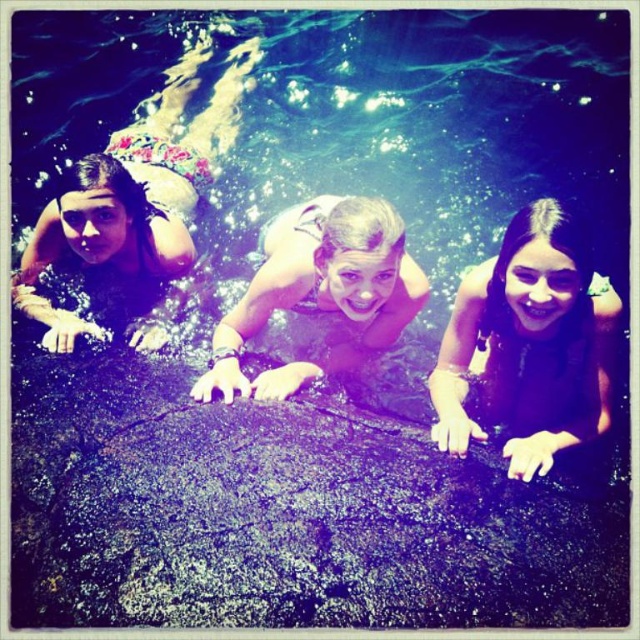
Is floral swimsuit at left further to camera compared to smooth skin girl at center?

Yes, it is.

Does floral swimsuit at left have a lesser height compared to smooth skin girl at center?

No.

What do you see at coordinates (134, 205) in the screenshot? I see `floral swimsuit at left` at bounding box center [134, 205].

This screenshot has width=640, height=640. Find the location of `floral swimsuit at left`. floral swimsuit at left is located at coordinates (134, 205).

Can you confirm if black matte hair at center is shorter than floral swimsuit at left?

Yes.

Can you confirm if black matte hair at center is positioned to the left of floral swimsuit at left?

In fact, black matte hair at center is to the right of floral swimsuit at left.

Which is behind, point (458, 364) or point (54, 346)?

The point (54, 346) is behind.

Identify the location of black matte hair at center. (531, 342).

Between black matte hair at center and smooth skin girl at center, which one appears on the right side from the viewer's perspective?

Positioned to the right is black matte hair at center.

Which is in front, point (532, 262) or point (288, 225)?

Point (532, 262) is in front.

Locate an element on the screen. black matte hair at center is located at coordinates (531, 342).